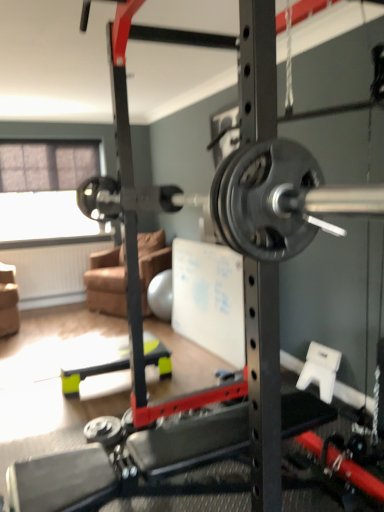
Question: Does point (142, 283) appear closer or farther from the camera than point (94, 169)?

Choices:
 (A) farther
 (B) closer

Answer: (B)

Question: From their relative heights in the image, would you say brown fabric couch at center is taller or shorter than transparent fabric at left?

Choices:
 (A) short
 (B) tall

Answer: (A)

Question: From the image's perspective, is brown fabric couch at center located above or below transparent fabric at left?

Choices:
 (A) below
 (B) above

Answer: (A)

Question: Do you think transparent fabric at left is within brown fabric couch at center, or outside of it?

Choices:
 (A) outside
 (B) inside

Answer: (A)

Question: In terms of width, does transparent fabric at left look wider or thinner when compared to brown fabric couch at center?

Choices:
 (A) thin
 (B) wide

Answer: (A)

Question: Does point (56, 202) appear closer or farther from the camera than point (120, 291)?

Choices:
 (A) closer
 (B) farther

Answer: (B)

Question: In the image, is transparent fabric at left on the left side or the right side of brown fabric couch at center?

Choices:
 (A) left
 (B) right

Answer: (A)